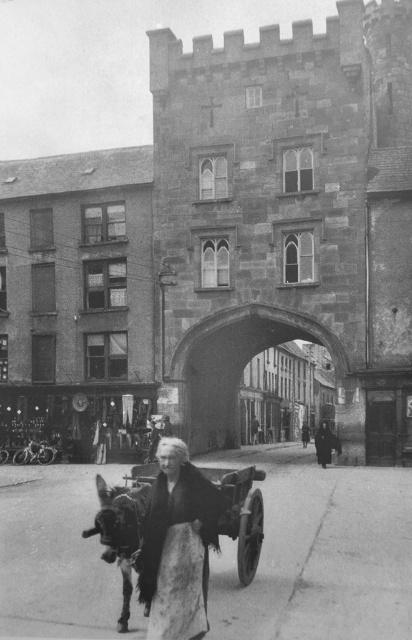
Is point (194, 564) positioned before point (231, 531)?

Yes, point (194, 564) is in front of point (231, 531).

Does point (159, 561) lie behind point (135, 468)?

No, (159, 561) is closer to viewer.

At what (x,y) coordinates should I click in order to perform the action: click on dark brown fur coat at center. Please return your answer as a coordinate pair (x, y). The width and height of the screenshot is (412, 640). Looking at the image, I should click on (177, 545).

Identify the location of dark brown fur coat at center. (177, 545).